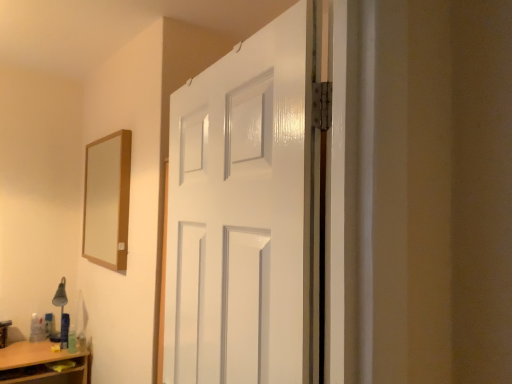
Question: Should I look upward or downward to see matte silver table lamp at lower left?

Choices:
 (A) down
 (B) up

Answer: (A)

Question: Is wooden-framed mirror at upper left bigger than white glossy door at center?

Choices:
 (A) no
 (B) yes

Answer: (A)

Question: From a real-world perspective, is wooden-framed mirror at upper left over white glossy door at center?

Choices:
 (A) no
 (B) yes

Answer: (B)

Question: Is wooden-framed mirror at upper left at the right side of white glossy door at center?

Choices:
 (A) no
 (B) yes

Answer: (A)

Question: Is the depth of wooden-framed mirror at upper left less than that of white glossy door at center?

Choices:
 (A) no
 (B) yes

Answer: (A)

Question: Can you confirm if wooden-framed mirror at upper left is wider than white glossy door at center?

Choices:
 (A) no
 (B) yes

Answer: (A)

Question: Can you confirm if wooden-framed mirror at upper left is positioned to the left of white glossy door at center?

Choices:
 (A) no
 (B) yes

Answer: (B)

Question: Is matte silver table lamp at lower left to the left of white glossy door at center from the viewer's perspective?

Choices:
 (A) yes
 (B) no

Answer: (A)

Question: Considering the relative sizes of matte silver table lamp at lower left and white glossy door at center in the image provided, is matte silver table lamp at lower left smaller than white glossy door at center?

Choices:
 (A) yes
 (B) no

Answer: (A)

Question: Does matte silver table lamp at lower left turn towards white glossy door at center?

Choices:
 (A) no
 (B) yes

Answer: (B)

Question: Can you confirm if matte silver table lamp at lower left is bigger than white glossy door at center?

Choices:
 (A) no
 (B) yes

Answer: (A)

Question: From the image's perspective, is matte silver table lamp at lower left below white glossy door at center?

Choices:
 (A) no
 (B) yes

Answer: (B)

Question: Does matte silver table lamp at lower left have a lesser width compared to white glossy door at center?

Choices:
 (A) no
 (B) yes

Answer: (A)

Question: Is white glossy door at center located outside matte silver table lamp at lower left?

Choices:
 (A) yes
 (B) no

Answer: (A)